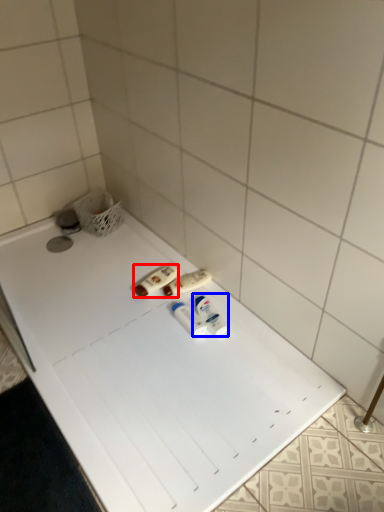
Question: Which point is closer to the camera, toiletry (highlighted by a red box) or toiletry (highlighted by a blue box)?

Choices:
 (A) toiletry
 (B) toiletry

Answer: (B)